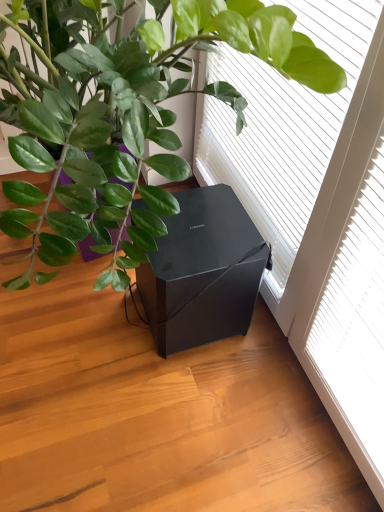
This screenshot has height=512, width=384. Find the location of `green glossy leafy plant at upper left`. green glossy leafy plant at upper left is located at coordinates [122, 113].

Describe the element at coordinates (122, 113) in the screenshot. I see `green glossy leafy plant at upper left` at that location.

What is the approximate height of green glossy leafy plant at upper left?

The height of green glossy leafy plant at upper left is 1.05 meters.

Identify the location of green glossy leafy plant at upper left. (122, 113).